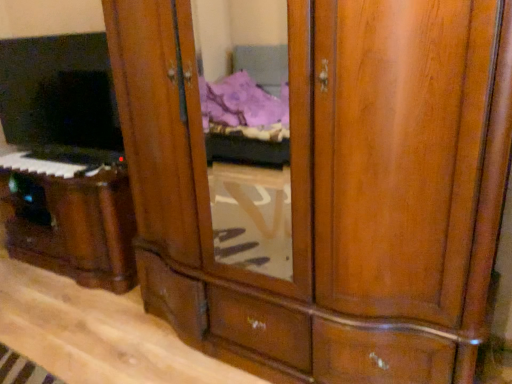
Locate an element on the screen. matte black tv at left is located at coordinates (65, 161).

Where is `wooden piano at lower left`? wooden piano at lower left is located at coordinates (73, 226).

Describe the element at coordinates (50, 162) in the screenshot. The height and width of the screenshot is (384, 512). I see `matte black keyboard at left` at that location.

In order to click on matte black tv at left in this screenshot , I will do `click(65, 161)`.

Is matte black keyboard at left positioned beyond the bounds of matte black tv at left?

Yes, matte black keyboard at left is outside of matte black tv at left.

Considering the sizes of matte black keyboard at left and matte black tv at left in the image, is matte black keyboard at left taller or shorter than matte black tv at left?

matte black keyboard at left is shorter than matte black tv at left.

From the image's perspective, who appears lower, matte black keyboard at left or matte black tv at left?

matte black keyboard at left is shown below in the image.

From a real-world perspective, between matte black keyboard at left and matte black tv at left, who is vertically lower?

From a 3D spatial view, matte black keyboard at left is below.

Are matte black tv at left and matte black keyboard at left far apart?

No.

Is matte black tv at left oriented towards matte black keyboard at left?

No, matte black tv at left is not aimed at matte black keyboard at left.

From the image's perspective, is matte black tv at left located above or below matte black keyboard at left?

Based on their image positions, matte black tv at left is located above matte black keyboard at left.

Identify the location of entertainment center in front of the matte black keyboard at left. Image resolution: width=512 pixels, height=384 pixels. (65, 161).

From the image's perspective, which object appears higher, matte black tv at left or wooden piano at lower left?

matte black tv at left.

Does point (81, 107) appear closer or farther from the camera than point (33, 246)?

Point (81, 107) appears to be closer to the viewer than point (33, 246).

What's the angular difference between matte black tv at left and wooden piano at lower left's facing directions?

The facing directions of matte black tv at left and wooden piano at lower left are 2.13 degrees apart.

From the image's perspective, between wooden piano at lower left and matte black keyboard at left, who is located below?

wooden piano at lower left, from the image's perspective.

Considering the relative positions of wooden piano at lower left and matte black keyboard at left in the image provided, is wooden piano at lower left in front of matte black keyboard at left?

Yes, wooden piano at lower left is in front of matte black keyboard at left.

Where is `musical keyboard above the wooden piano at lower left (from a real-world perspective)`? musical keyboard above the wooden piano at lower left (from a real-world perspective) is located at coordinates (50, 162).

Considering the positions of points (78, 221) and (66, 152), is point (78, 221) farther from camera compared to point (66, 152)?

No, it is in front of (66, 152).

Between wooden piano at lower left and matte black tv at left, which one has more height?

With more height is matte black tv at left.

Could you tell me if wooden piano at lower left is turned towards matte black tv at left?

No, wooden piano at lower left is not aimed at matte black tv at left.

From a real-world perspective, which object rests below the other?

wooden piano at lower left is physically lower.

Is matte black keyboard at left shorter than wooden piano at lower left?

Indeed, matte black keyboard at left has a lesser height compared to wooden piano at lower left.

Which object is wider, matte black keyboard at left or wooden piano at lower left?

wooden piano at lower left.

Can you confirm if matte black keyboard at left is smaller than wooden piano at lower left?

Indeed, matte black keyboard at left has a smaller size compared to wooden piano at lower left.

Is matte black keyboard at left in front of or behind wooden piano at lower left in the image?

In the image, matte black keyboard at left appears behind wooden piano at lower left.

Where is `musical keyboard below the matte black tv at left (from a real-world perspective)`? musical keyboard below the matte black tv at left (from a real-world perspective) is located at coordinates (50, 162).

Where is `entertainment center above the matte black keyboard at left (from the image's perspective)`? The height and width of the screenshot is (384, 512). entertainment center above the matte black keyboard at left (from the image's perspective) is located at coordinates (65, 161).

Estimate the real-world distances between objects in this image. Which object is further from matte black tv at left, wooden piano at lower left or matte black keyboard at left?

Among the two, matte black keyboard at left is located further to matte black tv at left.

From the image, which object appears to be farther from matte black keyboard at left, wooden piano at lower left or matte black tv at left?

The object further to matte black keyboard at left is wooden piano at lower left.

When comparing their distances from matte black keyboard at left, does matte black tv at left or wooden piano at lower left seem further?

The object further to matte black keyboard at left is wooden piano at lower left.

Which object lies nearer to the anchor point wooden piano at lower left, matte black tv at left or matte black keyboard at left?

matte black tv at left lies closer to wooden piano at lower left than the other object.

Which object lies further to the anchor point matte black tv at left, matte black keyboard at left or wooden piano at lower left?

Among the two, matte black keyboard at left is located further to matte black tv at left.

Looking at the image, which one is located closer to wooden piano at lower left, matte black keyboard at left or matte black tv at left?

Based on the image, matte black tv at left appears to be nearer to wooden piano at lower left.

At what (x,y) coordinates should I click in order to perform the action: click on musical keyboard between matte black tv at left and wooden piano at lower left in the up-down direction. Please return your answer as a coordinate pair (x, y). The image size is (512, 384). Looking at the image, I should click on (50, 162).